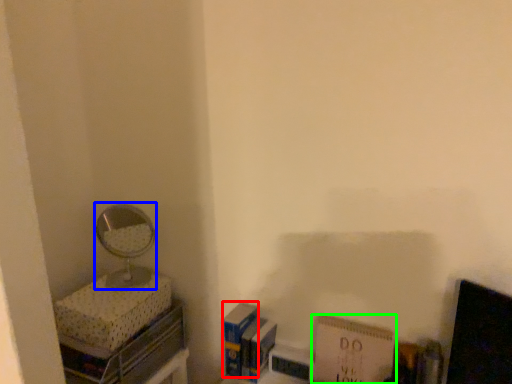
Question: Which object is the closest to the paperback book (highlighted by a red box)? Choose among these: mirror (highlighted by a blue box) or paperback book (highlighted by a green box).

Choices:
 (A) mirror
 (B) paperback book

Answer: (B)